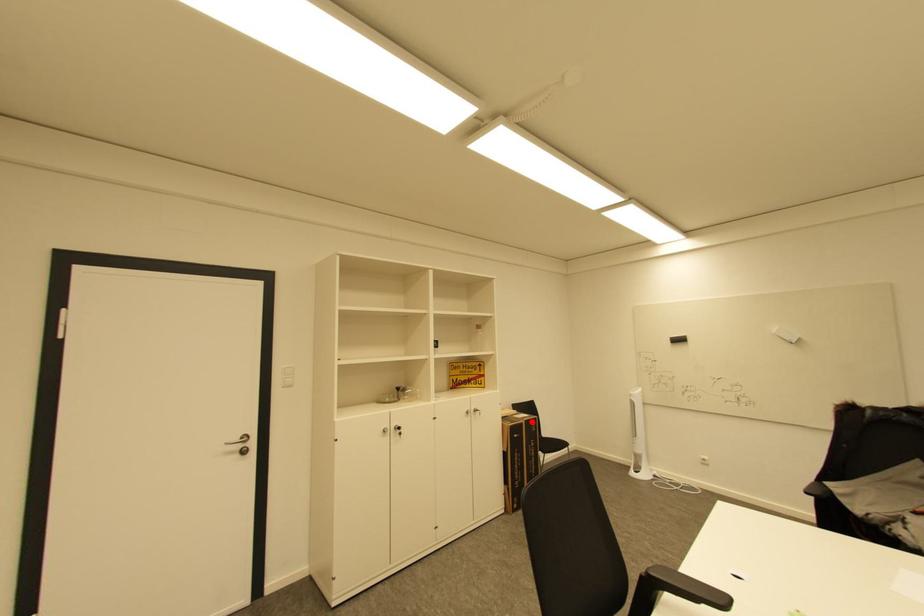
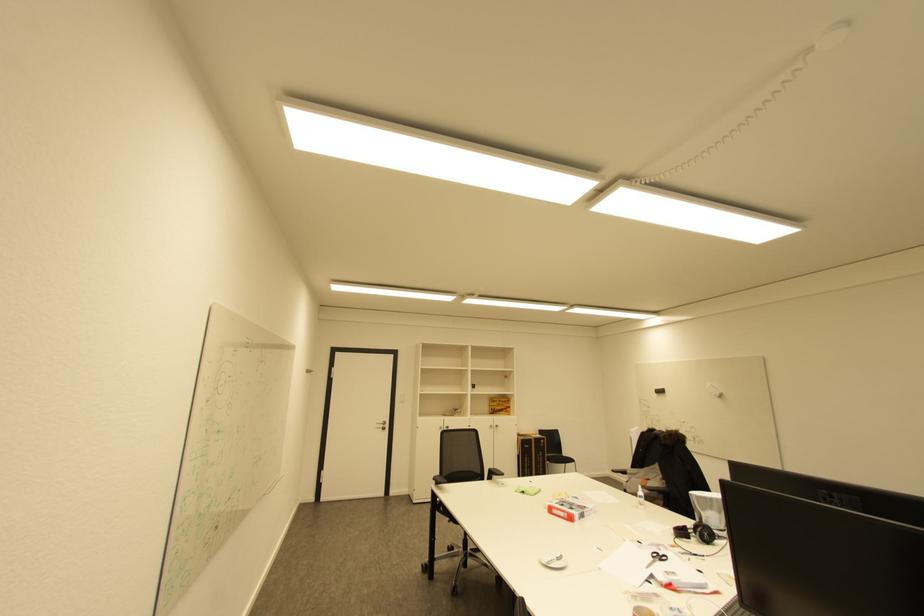
Question: I am providing you with two images of the same scene from different viewpoints. Image1 has a red point marked. In image2, the corresponding 3D location appears at what relative position? Reply with the corresponding letter.

Choices:
 (A) Closer
 (B) Farther

Answer: (B)